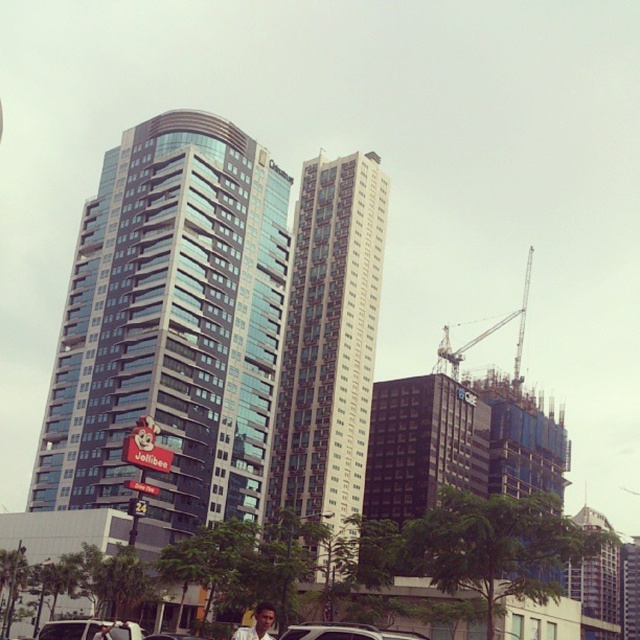
You are a delivery driver in a silver metallic suv at center and need to pick up a package from the person with light brown hair at lower center. Can you reach them directly from your current position without moving around any obstacles?

The silver metallic suv at center is positioned on the right side of light brown hair at lower center, so you can reach them directly by moving left since there are no obstacles mentioned in the scene description.

You are a pedestrian standing at the crosswalk in front of the glassy steel building at left. You want to cross the street to reach the construction site on the right. Can you see the metallic silver car at center from your current position?

The metallic silver car at center is behind the glassy steel building at left, so you cannot see it from your current position at the crosswalk in front of the glassy steel building at left.

You are a delivery driver needing to park your silver metallic suv at center near the Jollibee building. Given the coordinates provided, can you determine if the SUV is already positioned correctly for unloading?

The silver metallic suv at center is located at point [344,632], which likely places it near the Jollibee building on the left side of the image. Since the coordinates align with the central area between the buildings, the SUV is appropriately positioned for unloading.